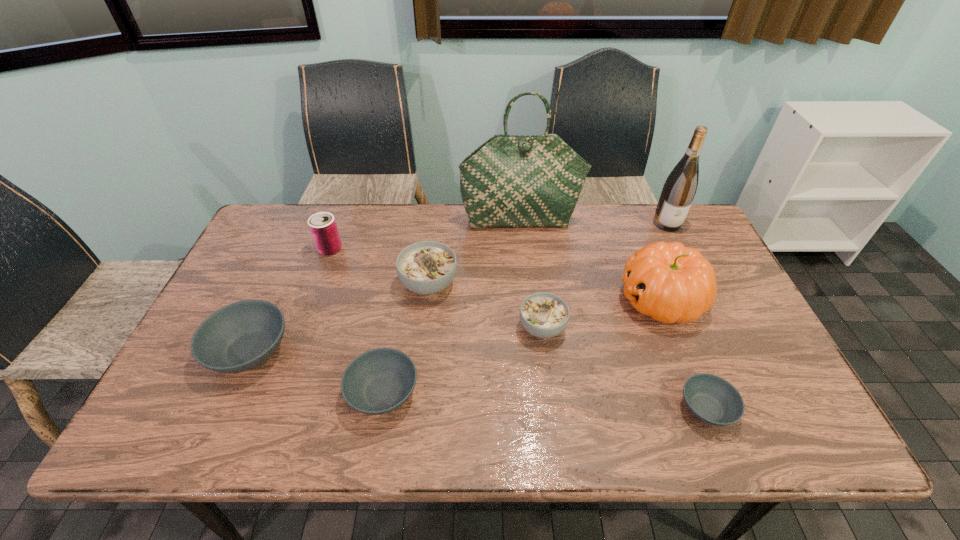
You are a GUI agent. You are given a task and a screenshot of the screen. Output one action in this format:
    pyautogui.click(x=<x>, y=<y>)
    Task: Click on the leftmost soup bowl
    
    Given the screenshot: What is the action you would take?
    pyautogui.click(x=241, y=336)

Identify the location of the leftmost gray soup bowl. (241, 336).

This screenshot has height=540, width=960. I want to click on the right white soup bowl, so click(x=544, y=315).

Image resolution: width=960 pixels, height=540 pixels. I want to click on the nearer white soup bowl, so click(544, 315).

Identify the location of the fourth tallest soup bowl. click(378, 381).

Where is `the second gray soup bowl from left to right`? the second gray soup bowl from left to right is located at coordinates (378, 381).

This screenshot has width=960, height=540. In order to click on the shortest soup bowl in this screenshot , I will do `click(712, 399)`.

Where is `the rightmost gray soup bowl`? the rightmost gray soup bowl is located at coordinates (712, 399).

The width and height of the screenshot is (960, 540). Identify the location of free space located 0.190m on the front of the green tote bag. (526, 272).

Locate an element on the screen. vacant region located on the label of the brown wine bottle is located at coordinates (708, 306).